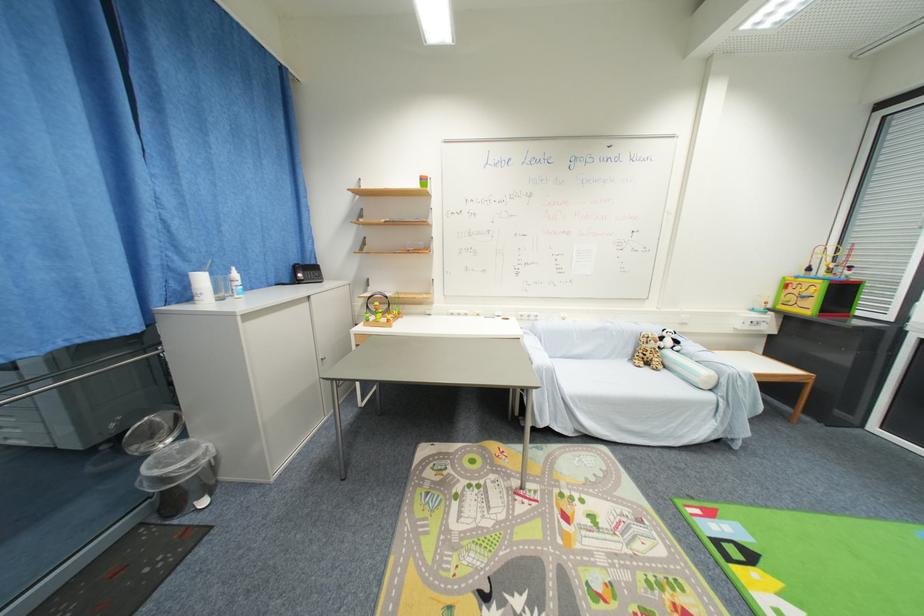
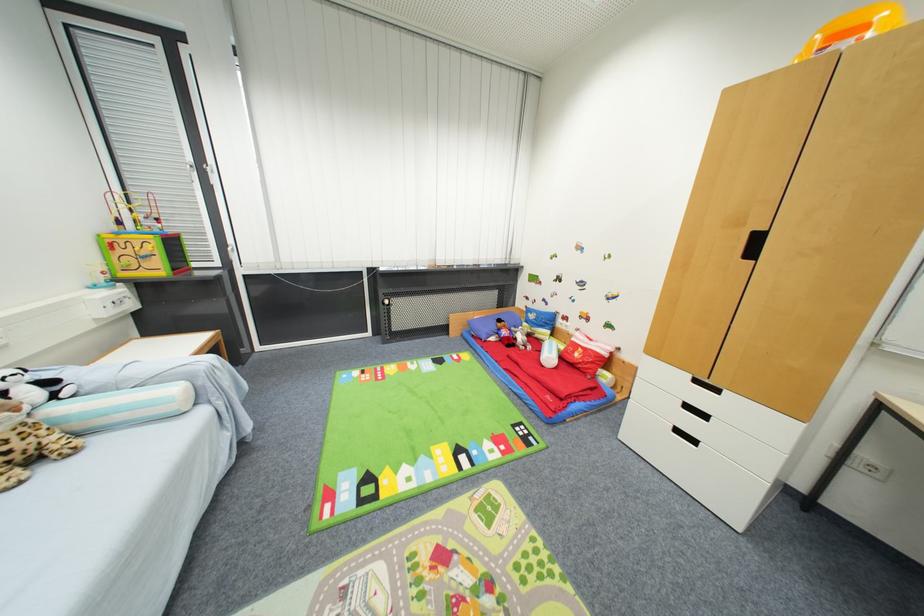
Locate, in the second image, the point that corresponds to pixel 682 342 in the first image.

(54, 384)